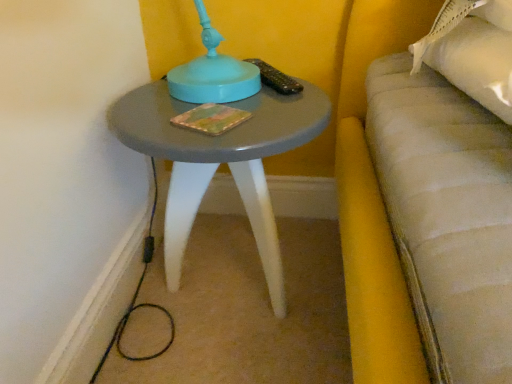
Describe the element at coordinates (211, 119) in the screenshot. The width and height of the screenshot is (512, 384). I see `multicolored textured book at center` at that location.

At what (x,y) coordinates should I click in order to perform the action: click on multicolored textured book at center. Please return your answer as a coordinate pair (x, y). Image resolution: width=512 pixels, height=384 pixels. Looking at the image, I should click on (211, 119).

This screenshot has width=512, height=384. What do you see at coordinates (220, 162) in the screenshot?
I see `matte gray table at center` at bounding box center [220, 162].

Measure the distance between point (283, 312) and camera.

The distance of point (283, 312) from camera is 35.51 inches.

In the scene shown: What is the approximate width of matte gray table at center?

matte gray table at center is 15.77 inches wide.

This screenshot has height=384, width=512. I want to click on matte gray table at center, so click(x=220, y=162).

This screenshot has width=512, height=384. I want to click on multicolored textured book at center, so click(x=211, y=119).

Looking at this image, does multicolored textured book at center appear on the left side of matte gray table at center?

Yes, multicolored textured book at center is to the left of matte gray table at center.

Which object is closer to the camera, multicolored textured book at center or matte gray table at center?

matte gray table at center is more forward.

Is point (216, 127) in front of point (265, 139)?

No, (216, 127) is further to viewer.

From the image's perspective, between multicolored textured book at center and matte gray table at center, who is located below?

matte gray table at center appears lower in the image.

From a real-world perspective, is multicolored textured book at center positioned above or below matte gray table at center?

multicolored textured book at center is above matte gray table at center.

Can you confirm if multicolored textured book at center is wider than matte gray table at center?

In fact, multicolored textured book at center might be narrower than matte gray table at center.

Considering the sizes of multicolored textured book at center and matte gray table at center in the image, is multicolored textured book at center taller or shorter than matte gray table at center?

Clearly, multicolored textured book at center is shorter compared to matte gray table at center.

Who is smaller, multicolored textured book at center or matte gray table at center?

With smaller size is multicolored textured book at center.

Would you say multicolored textured book at center is inside or outside matte gray table at center?

multicolored textured book at center is inside matte gray table at center.

Is the surface of multicolored textured book at center in direct contact with matte gray table at center?

No, multicolored textured book at center is not next to matte gray table at center.

Is multicolored textured book at center turned away from matte gray table at center?

Absolutely, multicolored textured book at center is directed away from matte gray table at center.

Where is `book above the matte gray table at center (from a real-world perspective)`? Image resolution: width=512 pixels, height=384 pixels. book above the matte gray table at center (from a real-world perspective) is located at coordinates (211, 119).

Considering the relative positions of matte gray table at center and multicolored textured book at center in the image provided, is matte gray table at center to the left of multicolored textured book at center from the viewer's perspective?

Incorrect, matte gray table at center is not on the left side of multicolored textured book at center.

In the image, is matte gray table at center positioned in front of or behind multicolored textured book at center?

matte gray table at center is in front of multicolored textured book at center.

Is point (166, 254) positioned behind point (231, 109)?

That is True.

From the image's perspective, is matte gray table at center positioned above or below multicolored textured book at center?

matte gray table at center is situated lower than multicolored textured book at center in the image.

From a real-world perspective, between matte gray table at center and multicolored textured book at center, who is vertically lower?

matte gray table at center, from a real-world perspective.

Which object is thinner, matte gray table at center or multicolored textured book at center?

With smaller width is multicolored textured book at center.

Consider the image. Between matte gray table at center and multicolored textured book at center, which one has more height?

matte gray table at center is taller.

Does matte gray table at center have a smaller size compared to multicolored textured book at center?

No.

Is matte gray table at center surrounding multicolored textured book at center?

Yes, multicolored textured book at center is a part of matte gray table at center.

Is matte gray table at center in contact with multicolored textured book at center?

matte gray table at center and multicolored textured book at center are clearly separated.

Consider the image. Is matte gray table at center turned away from multicolored textured book at center?

No, matte gray table at center is not facing the opposite direction of multicolored textured book at center.

How different are the orientations of matte gray table at center and multicolored textured book at center in degrees?

The angle between the facing direction of matte gray table at center and the facing direction of multicolored textured book at center is 27.7 degrees.

At what (x,y) coordinates should I click in order to perform the action: click on book above the matte gray table at center (from the image's perspective). Please return your answer as a coordinate pair (x, y). This screenshot has height=384, width=512. Looking at the image, I should click on (211, 119).

At what (x,y) coordinates should I click in order to perform the action: click on book above the matte gray table at center (from a real-world perspective). Please return your answer as a coordinate pair (x, y). The width and height of the screenshot is (512, 384). Looking at the image, I should click on (211, 119).

At what (x,y) coordinates should I click in order to perform the action: click on book that appears on the left of matte gray table at center. Please return your answer as a coordinate pair (x, y). Looking at the image, I should click on (211, 119).